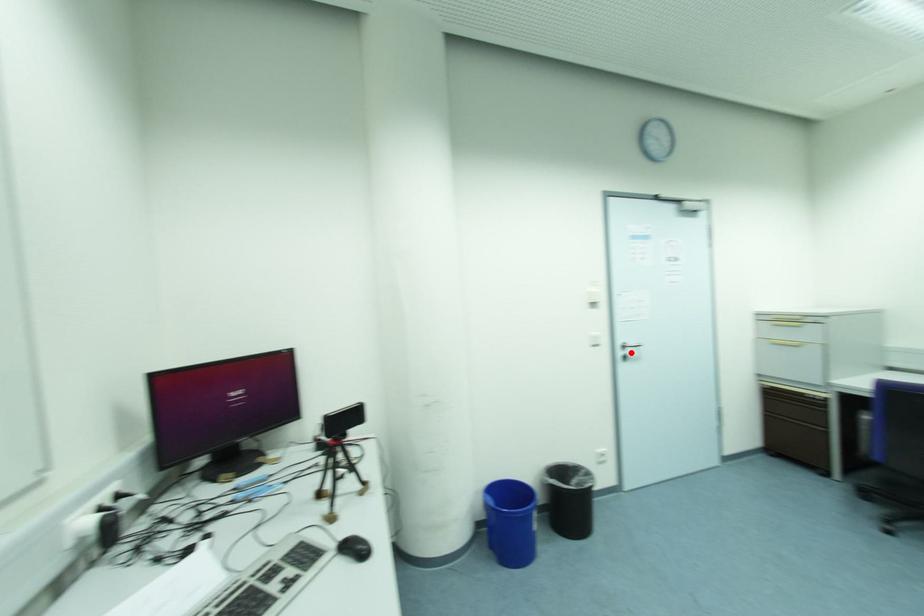
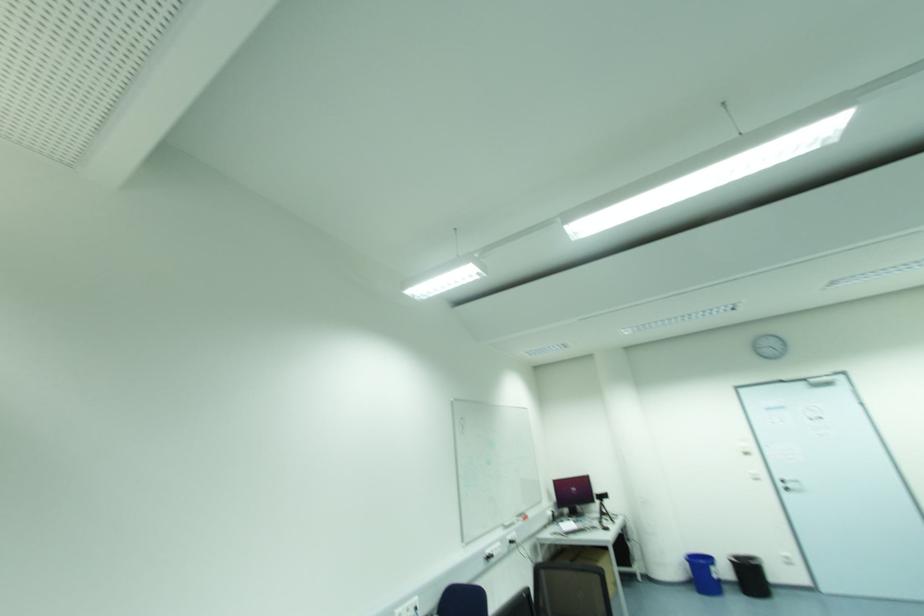
Question: I am providing you with two images of the same scene from different viewpoints. A red point is marked on the first image. Is the red point's position out of view in image 2?

Choices:
 (A) Yes
 (B) No

Answer: (B)